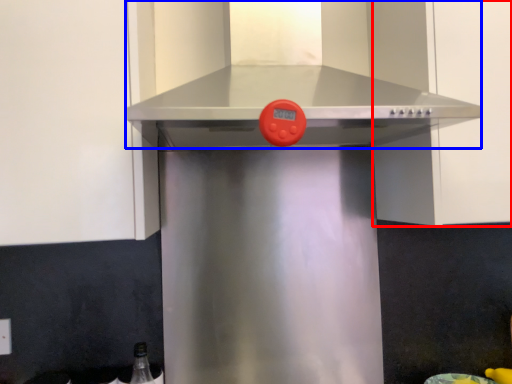
Question: Which point is closer to the camera, cabinetry (highlighted by a red box) or vent (highlighted by a blue box)?

Choices:
 (A) cabinetry
 (B) vent

Answer: (B)